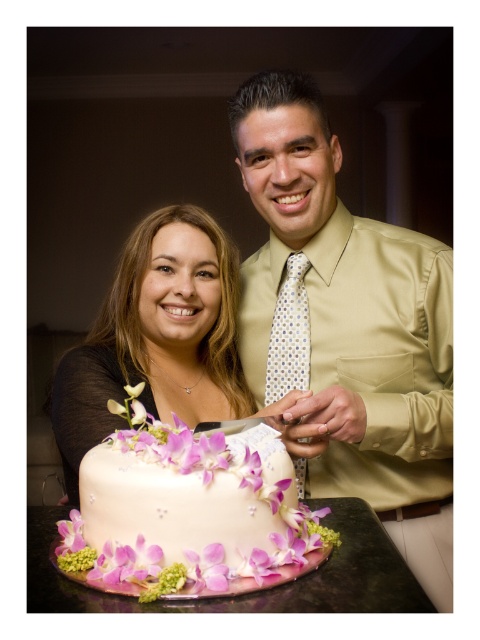
Question: Does white fondant cake with floral decorations at center have a lesser width compared to smooth cream cake at center?

Choices:
 (A) no
 (B) yes

Answer: (B)

Question: Which object is positioned closest to the matte gold shirt at center?

Choices:
 (A) smooth cream cake at center
 (B) white fondant cake with floral decorations at center

Answer: (A)

Question: Based on their relative distances, which object is farther from the smooth cream cake at center?

Choices:
 (A) matte gold shirt at center
 (B) white fondant cake with floral decorations at center

Answer: (B)

Question: Observing the image, what is the correct spatial positioning of matte gold shirt at center in reference to smooth cream cake at center?

Choices:
 (A) below
 (B) above

Answer: (B)

Question: Is matte gold shirt at center bigger than smooth cream cake at center?

Choices:
 (A) yes
 (B) no

Answer: (A)

Question: Which of the following is the closest to the observer?

Choices:
 (A) (193, 518)
 (B) (108, 324)
 (C) (287, 212)

Answer: (A)